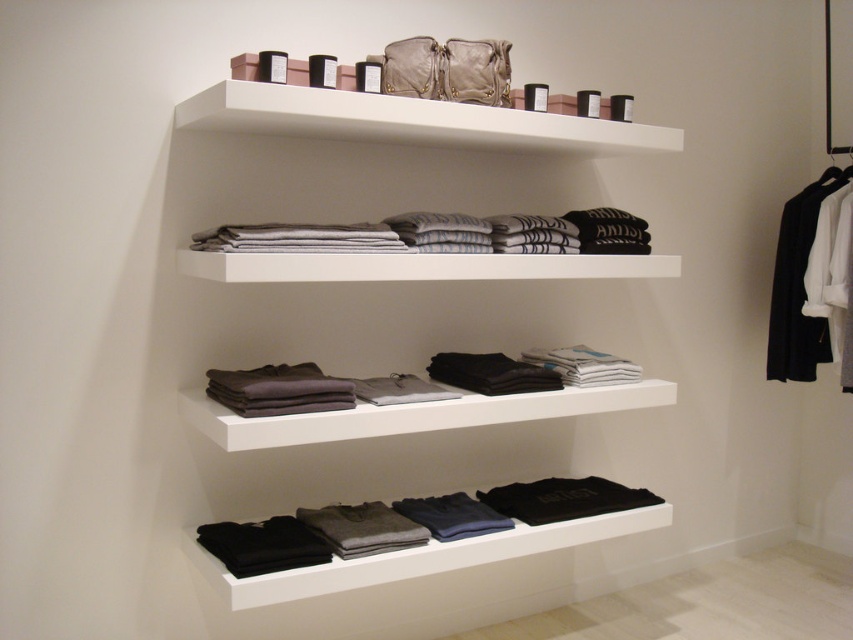
Does dark matte fabric at center have a larger size compared to dark gray cotton t-shirt at lower center?

Indeed, dark matte fabric at center has a larger size compared to dark gray cotton t-shirt at lower center.

Is point (277, 369) farther from viewer compared to point (357, 525)?

Yes, point (277, 369) is farther from viewer.

Does point (245, 394) come behind point (401, 534)?

No, it is not.

What are the coordinates of `dark matte fabric at center` in the screenshot? It's located at (279, 388).

Is gray cotton t-shirts at center above dark matte fabric at center?

Yes, gray cotton t-shirts at center is above dark matte fabric at center.

Which of these two, gray cotton t-shirts at center or dark matte fabric at center, stands shorter?

With less height is dark matte fabric at center.

Which is in front, point (225, 250) or point (265, 374)?

Point (225, 250) is more forward.

Where is `gray cotton t-shirts at center`? gray cotton t-shirts at center is located at coordinates (444, 234).

Consider the image. Which is more to the right, gray cotton t-shirts at center or black fabric coat at right?

Positioned to the right is black fabric coat at right.

Is point (422, 250) more distant than point (788, 358)?

No, (422, 250) is closer to viewer.

Identify the location of gray cotton t-shirts at center. Image resolution: width=853 pixels, height=640 pixels. (444, 234).